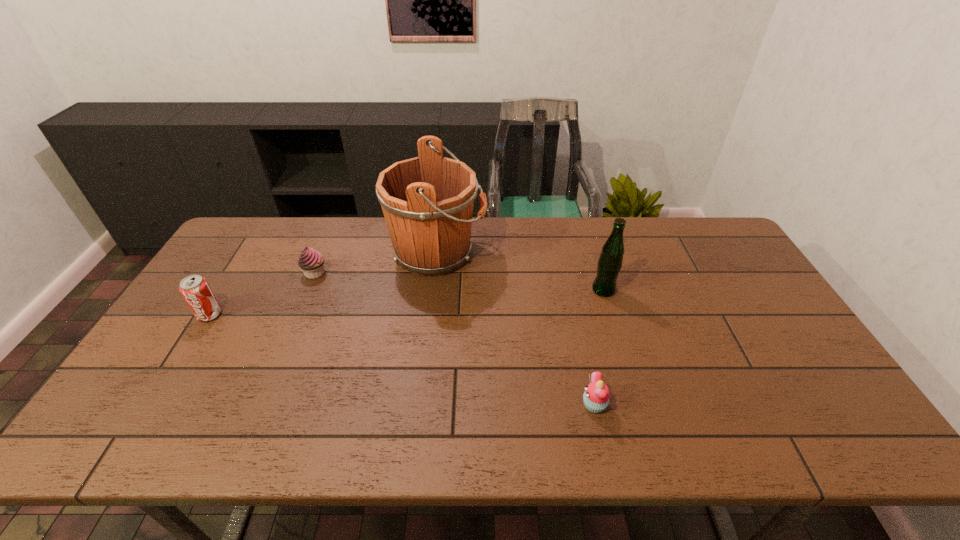
Where is `free location at the far edge of the desktop`? The height and width of the screenshot is (540, 960). free location at the far edge of the desktop is located at coordinates (526, 221).

The width and height of the screenshot is (960, 540). In order to click on free location at the near edge in this screenshot , I will do (422, 446).

In the image, there is a desktop. Where is `vacant space at the left edge`? The height and width of the screenshot is (540, 960). vacant space at the left edge is located at coordinates (168, 362).

I want to click on free space at the right edge of the desktop, so click(716, 286).

The height and width of the screenshot is (540, 960). I want to click on vacant point located between the third tallest object and the farther cupcake, so click(x=262, y=294).

The width and height of the screenshot is (960, 540). What are the coordinates of `vacant point located between the tallest object and the beer bottle` in the screenshot? It's located at (520, 272).

The width and height of the screenshot is (960, 540). I want to click on vacant point located between the nearest object and the third shortest object, so click(402, 360).

Locate an element on the screen. This screenshot has height=540, width=960. free space between the second object from right to left and the rightmost object is located at coordinates (599, 347).

Image resolution: width=960 pixels, height=540 pixels. I want to click on free space between the rightmost object and the tallest object, so click(x=520, y=272).

Where is `unoccupied position between the left cupcake and the second tallest object`? The width and height of the screenshot is (960, 540). unoccupied position between the left cupcake and the second tallest object is located at coordinates (459, 281).